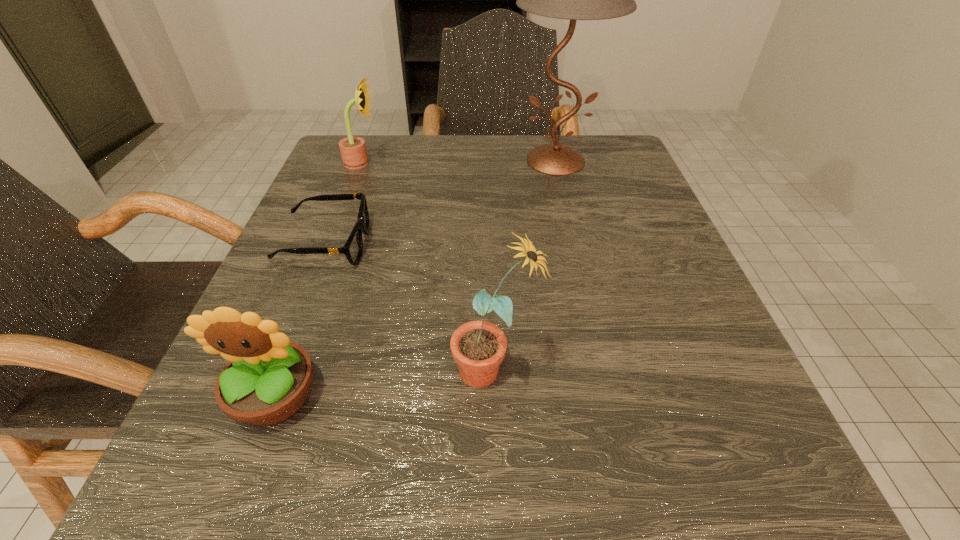
I want to click on vacant area that lies between the second tallest object and the tallest object, so click(x=525, y=265).

This screenshot has width=960, height=540. I want to click on vacant space that is in between the tallest object and the tallest sunflower, so click(x=525, y=265).

The height and width of the screenshot is (540, 960). In order to click on blank region between the farthest sunflower and the tallest object in this screenshot , I will do `click(459, 162)`.

Identify the location of free spot between the third farthest object and the rightmost sunflower. (410, 307).

The width and height of the screenshot is (960, 540). Find the location of `vacant area that lies between the second tallest object and the farthest sunflower`. vacant area that lies between the second tallest object and the farthest sunflower is located at coordinates (428, 266).

Locate which object ranks second in proximity to the shortest object. Please provide its 2D coordinates. Your answer should be formatted as a tuple, i.e. [(x, y)], where the tuple contains the x and y coordinates of a point satisfying the conditions above.

[(267, 379)]

Identify which object is the closest to the tallest sunflower. Please provide its 2D coordinates. Your answer should be formatted as a tuple, i.e. [(x, y)], where the tuple contains the x and y coordinates of a point satisfying the conditions above.

[(267, 379)]

Select which sunflower is the closest to the rightmost sunflower. Please provide its 2D coordinates. Your answer should be formatted as a tuple, i.e. [(x, y)], where the tuple contains the x and y coordinates of a point satisfying the conditions above.

[(267, 379)]

I want to click on the closest sunflower to the fourth shortest object, so click(x=267, y=379).

Where is `free location that satisfies the following two spatial constraints: 1. on the front-facing side of the table lamp; 2. on the flower of the rightmost sunflower`? The image size is (960, 540). free location that satisfies the following two spatial constraints: 1. on the front-facing side of the table lamp; 2. on the flower of the rightmost sunflower is located at coordinates (607, 370).